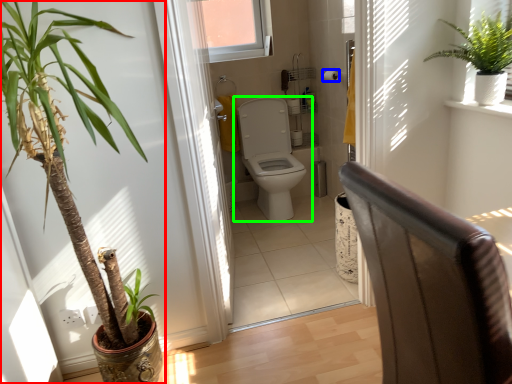
Question: Considering the real-world distances, which object is farthest from houseplant (highlighted by a red box)? toilet paper (highlighted by a blue box) or toilet (highlighted by a green box)?

Choices:
 (A) toilet paper
 (B) toilet

Answer: (A)